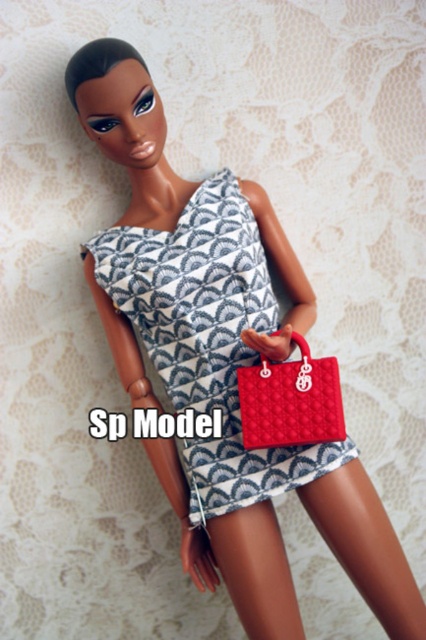
You are a fashion designer looking at the doll and want to ensure the handbag is visible. Is the matte red handbag at lower right covered by the patterned fabric dress at center?

The patterned fabric dress at center is positioned over matte red handbag at lower right, so the handbag is partially or fully covered and may not be easily visible.

You are an interior designer arranging items in a room. You have a patterned fabric dress at center and a matte red handbag at lower right. Which item is closer to the viewer?

The patterned fabric dress at center is closer to the viewer because the matte red handbag at lower right is behind it.